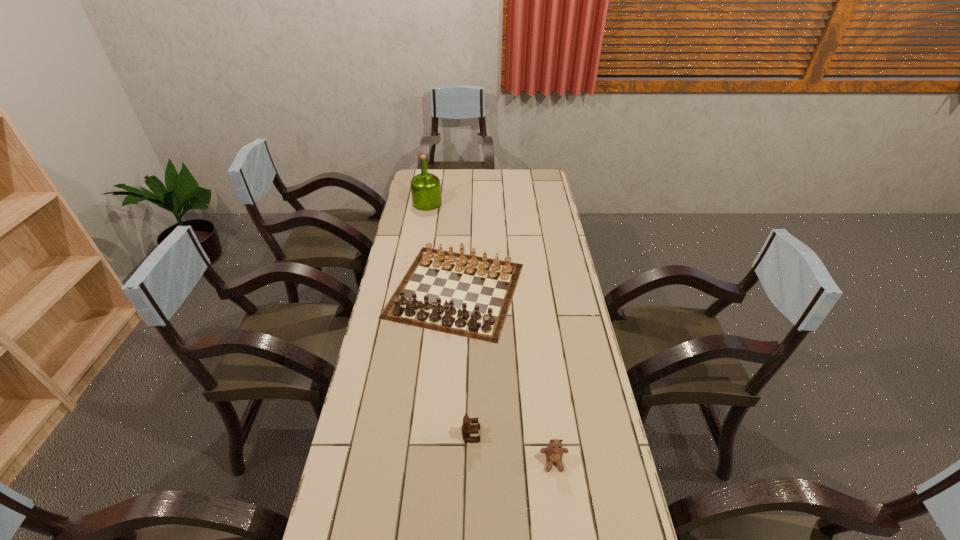
You are a GUI agent. You are given a task and a screenshot of the screen. Output one action in this format:
    pyautogui.click(x=<x>, y=<y>)
    Task: Click on the tallest object
    Image resolution: width=960 pixels, height=540 pixels.
    Given the screenshot: What is the action you would take?
    pyautogui.click(x=425, y=187)

Find the location of a particular element. This screenshot has width=960, height=540. olive oil is located at coordinates (425, 187).

The height and width of the screenshot is (540, 960). I want to click on chessboard, so click(x=459, y=295).

Find the location of a particular element. The width and height of the screenshot is (960, 540). the right teddy bear is located at coordinates (554, 451).

Image resolution: width=960 pixels, height=540 pixels. In order to click on the nearer teddy bear in this screenshot , I will do `click(554, 451)`.

The height and width of the screenshot is (540, 960). Find the location of `the left teddy bear`. the left teddy bear is located at coordinates (x=470, y=425).

The height and width of the screenshot is (540, 960). I want to click on the third farthest object, so click(x=470, y=425).

Where is `vacant space located on the front of the olive oil`? The height and width of the screenshot is (540, 960). vacant space located on the front of the olive oil is located at coordinates (420, 245).

Locate an element on the screen. Image resolution: width=960 pixels, height=540 pixels. vacant region located on the front of the second farthest object is located at coordinates (448, 409).

Locate an element on the screen. This screenshot has height=540, width=960. free region located on the front-facing side of the right teddy bear is located at coordinates (562, 522).